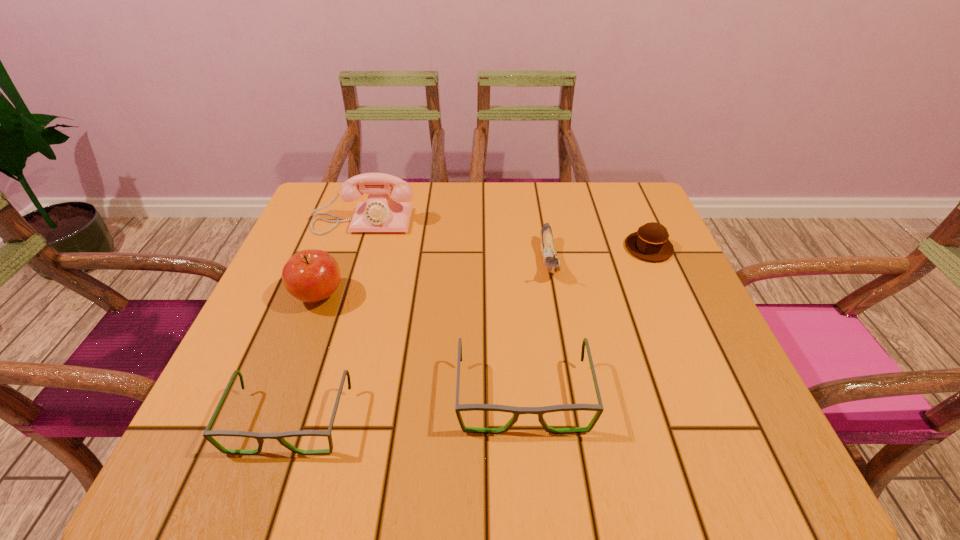
The height and width of the screenshot is (540, 960). I want to click on free space at the far edge, so click(x=443, y=233).

The width and height of the screenshot is (960, 540). I want to click on free space at the near edge, so click(x=350, y=415).

Identify the location of free region at the right edge of the desktop. This screenshot has height=540, width=960. (636, 288).

Locate an element on the screen. Image resolution: width=960 pixels, height=540 pixels. vacant region at the far left corner is located at coordinates (330, 197).

Find the location of a particular element. This screenshot has height=540, width=960. vacant area at the near left corner of the desktop is located at coordinates (266, 391).

In the image, there is a desktop. Identify the location of vacant space at the far right corner. Image resolution: width=960 pixels, height=540 pixels. (604, 198).

The image size is (960, 540). What are the coordinates of `free space that is in between the right spectacles and the rightmost object` in the screenshot? It's located at (586, 321).

Where is `empty location between the shorter spectacles and the second tallest object`? The width and height of the screenshot is (960, 540). empty location between the shorter spectacles and the second tallest object is located at coordinates tap(304, 358).

You are a GUI agent. You are given a task and a screenshot of the screen. Output one action in this format:
    pyautogui.click(x=<x>, y=<y>)
    Task: Click on the vacant space that's between the telephone and the apple
    
    Given the screenshot: What is the action you would take?
    pyautogui.click(x=341, y=259)

You are a GUI agent. You are given a task and a screenshot of the screen. Output one action in this format:
    pyautogui.click(x=<x>, y=<y>)
    Task: Click on the blank region between the banana and the left spectacles
    This screenshot has height=540, width=960.
    Given the screenshot: What is the action you would take?
    pyautogui.click(x=420, y=340)